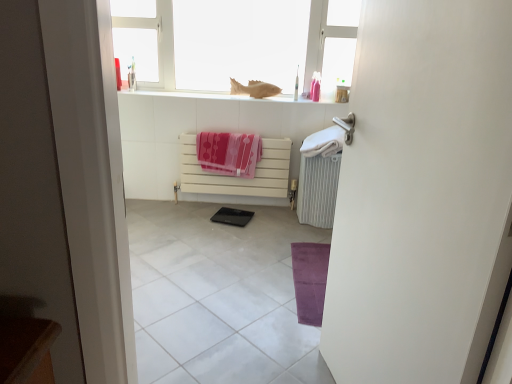
The height and width of the screenshot is (384, 512). Find the location of `free location in front of black glossy pad at center`. free location in front of black glossy pad at center is located at coordinates (230, 230).